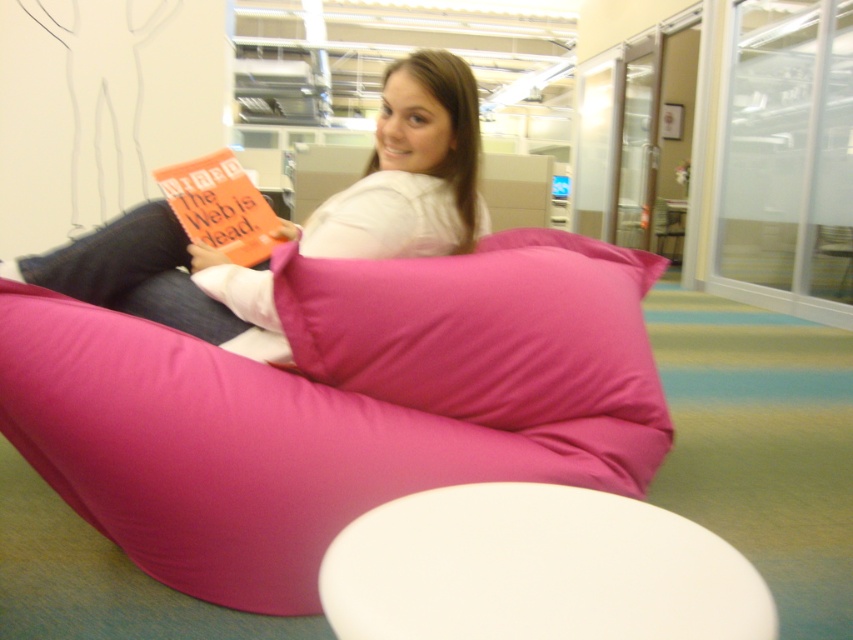
Does matte pink pillow at center appear on the left side of matte pink bean bag at center?

No, matte pink pillow at center is not to the left of matte pink bean bag at center.

Can you confirm if matte pink pillow at center is positioned below matte pink bean bag at center?

Indeed, matte pink pillow at center is positioned under matte pink bean bag at center.

Is point (334, 385) more distant than point (206, 256)?

No.

Identify the location of matte pink pillow at center. The width and height of the screenshot is (853, 640). (482, 330).

The image size is (853, 640). What do you see at coordinates (335, 404) in the screenshot?
I see `fuchsia fabric bean bag at center` at bounding box center [335, 404].

Measure the distance between fuchsia fabric bean bag at center and camera.

fuchsia fabric bean bag at center is 4.32 feet away from camera.

Locate an element on the screen. The height and width of the screenshot is (640, 853). fuchsia fabric bean bag at center is located at coordinates (335, 404).

Between point (474, 212) and point (239, 188), which one is positioned behind?

The point (239, 188) is behind.

Who is taller, matte pink bean bag at center or orange matte book at upper left?

matte pink bean bag at center

Is point (135, 221) less distant than point (244, 189)?

Yes.

At what (x,y) coordinates should I click in order to perform the action: click on matte pink bean bag at center. Please return your answer as a coordinate pair (x, y). This screenshot has width=853, height=640. Looking at the image, I should click on (409, 172).